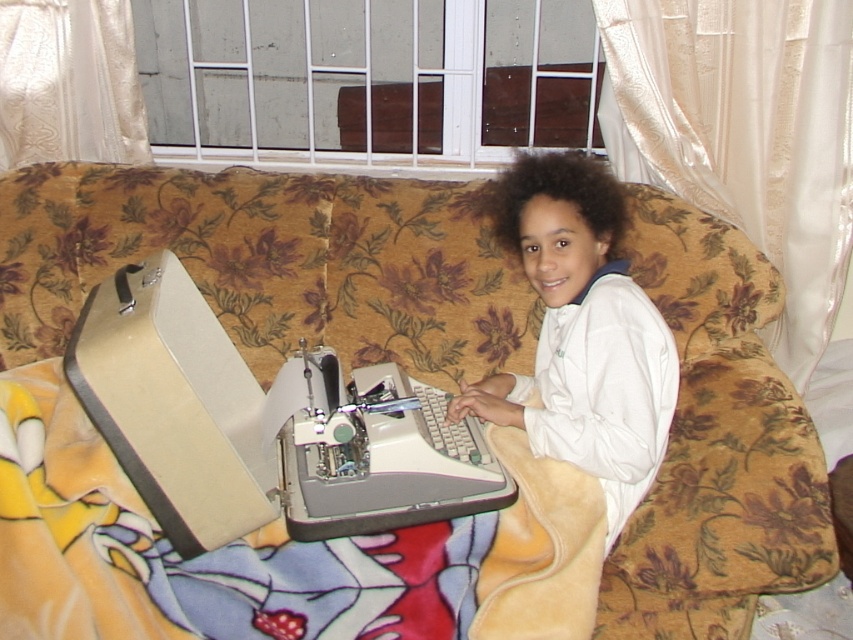
Question: Among these points, which one is nearest to the camera?

Choices:
 (A) (285, 616)
 (B) (263, 476)
 (C) (657, 125)
 (D) (71, 92)

Answer: (A)

Question: Is beige fabric sewing machine at center bigger than silky white curtain at upper right?

Choices:
 (A) yes
 (B) no

Answer: (B)

Question: Which point appears farthest from the camera in this image?

Choices:
 (A) (340, 563)
 (B) (299, 387)

Answer: (B)

Question: Based on their relative distances, which object is farther from the yellow fleece blanket at lower left?

Choices:
 (A) silky white curtain at upper right
 (B) floral fabric couch at center
 (C) white sheer curtain at upper left
 (D) white fleece at upper right

Answer: (A)

Question: Does floral fabric couch at center appear on the right side of silky white curtain at upper right?

Choices:
 (A) yes
 (B) no

Answer: (B)

Question: Where is beige fabric sewing machine at center located in relation to white sheer curtain at upper left in the image?

Choices:
 (A) above
 (B) below

Answer: (B)